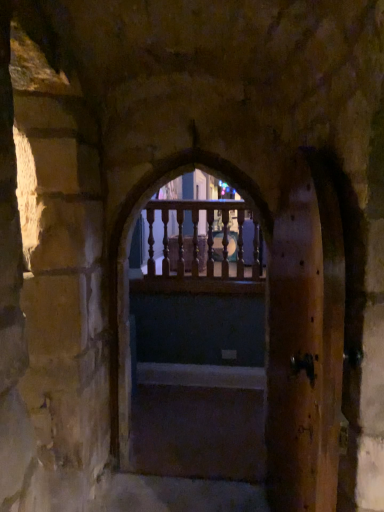
Where is `free space above dark wood stairs at center (from a real-world perspective)`? This screenshot has height=512, width=384. free space above dark wood stairs at center (from a real-world perspective) is located at coordinates (170, 422).